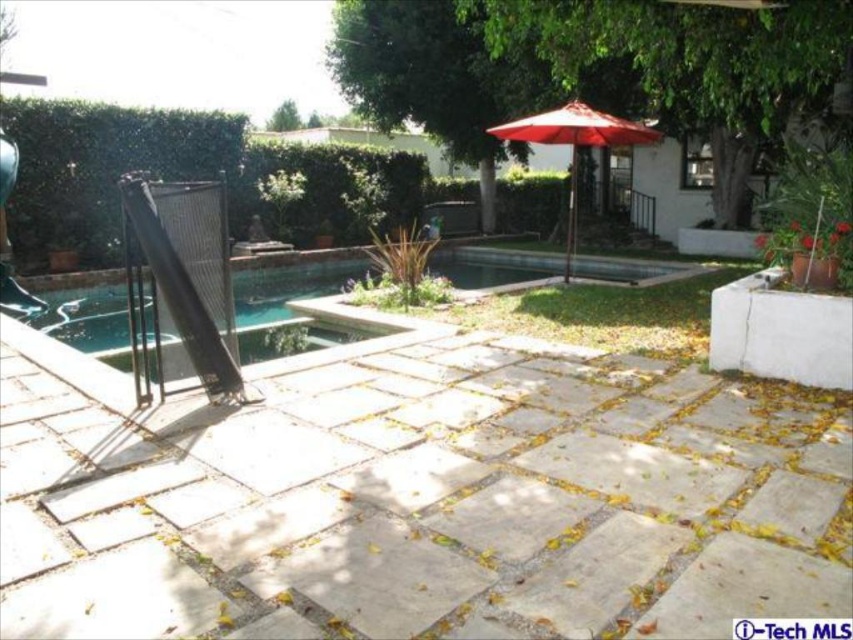
You are planning to place a small garden statue on the paved patio. The statue requires a spot that is not under the red fabric umbrella at center and not behind the green leafy hedge at center. Based on their positions, where should you place the statue?

The green leafy hedge at center is located above the red fabric umbrella at center. Therefore, placing the statue below the red fabric umbrella at center and in front of the green leafy hedge at center would satisfy the requirements.

You are planning to place a new decorative sculpture in the backyard. The sculpture is 1 meter wide. You want to place it between the green leafy hedge at center and the red fabric umbrella at center. Based on their widths, can the sculpture fit in the space between them?

The green leafy hedge at center is thinner than the red fabric umbrella at center, so the space between them may be sufficient to accommodate the 1 meter wide sculpture. However, the exact width of the space isn t specified, so it depends on how much space exists between their current positions.

You are standing at the edge of the pool in the backyard scene. There are two points marked in the image. Which point is closer to you, point (97, 188) or point (57, 298)?

Point (97, 188) is further to the viewer than point (57, 298), so point (57, 298) is closer to you.